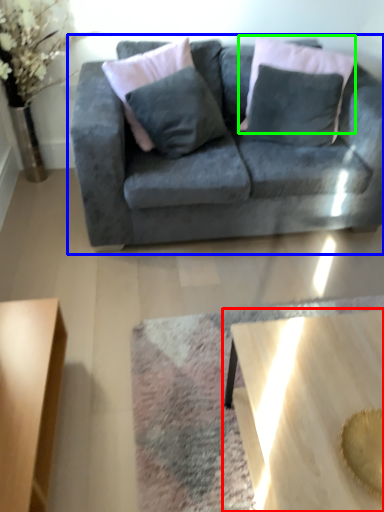
Question: Which is farther away from coffee table (highlighted by a red box)? studio couch (highlighted by a blue box) or pillow (highlighted by a green box)?

Choices:
 (A) studio couch
 (B) pillow

Answer: (B)